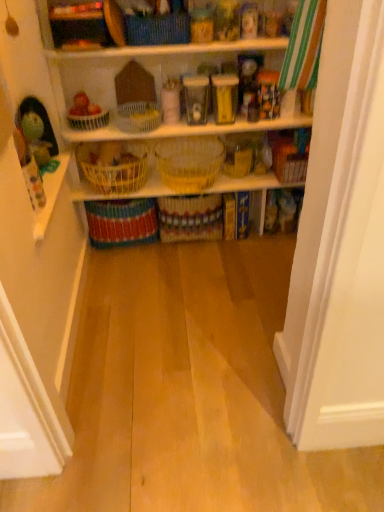
Question: In which direction should I rotate to look at woven fabric basket at upper center, marked as the 7th basket in a bottom-to-top arrangement?

Choices:
 (A) right
 (B) left

Answer: (B)

Question: Does woven yellow basket at center, marked as the fourth basket in a top-to-bottom arrangement, have a greater width compared to yellow woven basket at center, which appears as the second basket when ordered from the bottom?

Choices:
 (A) yes
 (B) no

Answer: (A)

Question: Does woven yellow basket at center, marked as the fourth basket in a top-to-bottom arrangement, have a smaller size compared to yellow woven basket at center, the sixth basket viewed from the top?

Choices:
 (A) no
 (B) yes

Answer: (B)

Question: Can yellow woven basket at center, which appears as the second basket when ordered from the bottom, be found inside woven yellow basket at center, which is the fourth basket in bottom-to-top order?

Choices:
 (A) no
 (B) yes

Answer: (A)

Question: Are woven yellow basket at center, marked as the fourth basket in a top-to-bottom arrangement, and yellow woven basket at center, the sixth basket viewed from the top, making contact?

Choices:
 (A) yes
 (B) no

Answer: (B)

Question: Is the position of woven yellow basket at center, which is the fourth basket in bottom-to-top order, more distant than that of yellow woven basket at center, which appears as the second basket when ordered from the bottom?

Choices:
 (A) yes
 (B) no

Answer: (B)

Question: Does woven yellow basket at center, marked as the fourth basket in a top-to-bottom arrangement, have a larger size compared to yellow woven basket at center, which appears as the second basket when ordered from the bottom?

Choices:
 (A) no
 (B) yes

Answer: (A)

Question: Is yellow wicker baskets at center wider than green plush toy at left?

Choices:
 (A) yes
 (B) no

Answer: (A)

Question: Considering the relative sizes of yellow wicker baskets at center and green plush toy at left in the image provided, is yellow wicker baskets at center taller than green plush toy at left?

Choices:
 (A) no
 (B) yes

Answer: (A)

Question: Is yellow wicker baskets at center at the right side of green plush toy at left?

Choices:
 (A) no
 (B) yes

Answer: (B)

Question: Is yellow wicker baskets at center placed right next to green plush toy at left?

Choices:
 (A) no
 (B) yes

Answer: (A)

Question: From the image's perspective, is yellow wicker baskets at center over green plush toy at left?

Choices:
 (A) no
 (B) yes

Answer: (A)

Question: Is yellow wicker baskets at center further to camera compared to green plush toy at left?

Choices:
 (A) no
 (B) yes

Answer: (B)

Question: Is white wicker basket at center, the third basket when ordered from top to bottom, oriented towards yellow wicker baskets at center?

Choices:
 (A) yes
 (B) no

Answer: (B)